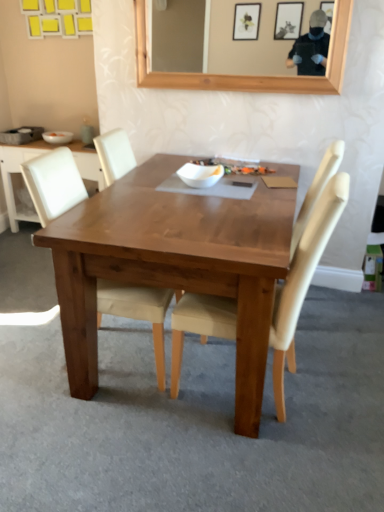
Question: Based on their positions, is wooden table at center located to the left or right of white matte bowl at center, arranged as the second bowl when viewed from the top?

Choices:
 (A) right
 (B) left

Answer: (B)

Question: From the image's perspective, is wooden table at center above or below white matte bowl at center, arranged as the second bowl when viewed from the top?

Choices:
 (A) below
 (B) above

Answer: (A)

Question: Based on their relative distances, which object is nearer to the white matte bowl at upper left, the second bowl positioned from the bottom?

Choices:
 (A) white matte bowl at center, acting as the 1th bowl starting from the right
 (B) matte gray coffee cup at upper left
 (C) beige fabric chair at center, the 1th chair in the right-to-left sequence
 (D) wooden table at center
 (E) light beige fabric chair at center, which appears as the 1th chair when viewed from the left

Answer: (B)

Question: Which object is the farthest from the white matte bowl at center, acting as the second bowl starting from the left?

Choices:
 (A) light beige fabric chair at center, which appears as the 1th chair when viewed from the left
 (B) white matte bowl at upper left, which ranks as the 1th bowl in left-to-right order
 (C) wooden table at center
 (D) matte gray coffee cup at upper left
 (E) beige fabric chair at center, the 1th chair in the right-to-left sequence

Answer: (B)